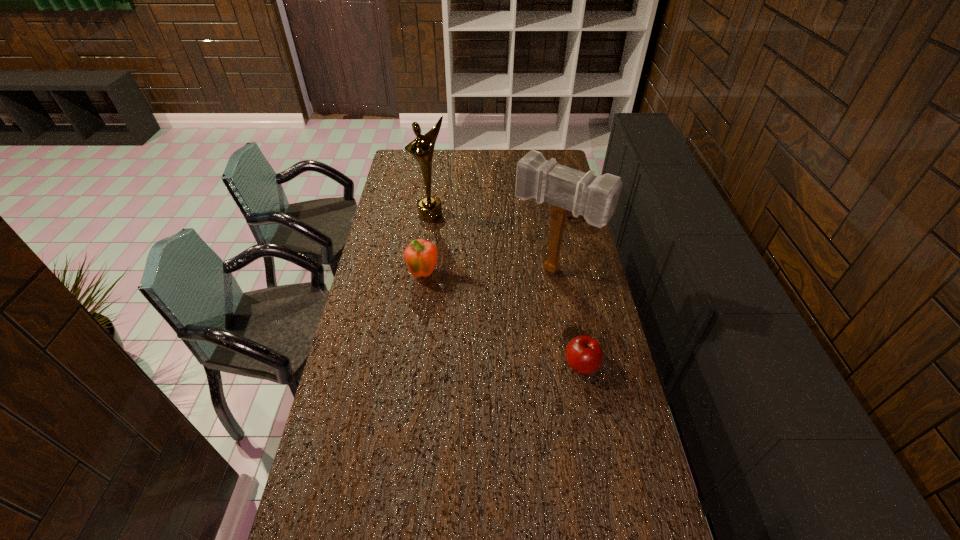
The image size is (960, 540). Identify the location of free spot on the desktop that is between the third shortest object and the nearest object and is positioned on the side with the handle of the cup. (481, 308).

Locate an element on the screen. The image size is (960, 540). free space on the desktop that is between the third shortest object and the apple and is positioned on the front-facing side of the award is located at coordinates (484, 309).

Where is `vacant space on the desktop that is between the pepper and the nearest object and is positioned at the head of the mallet`? Image resolution: width=960 pixels, height=540 pixels. vacant space on the desktop that is between the pepper and the nearest object and is positioned at the head of the mallet is located at coordinates (511, 325).